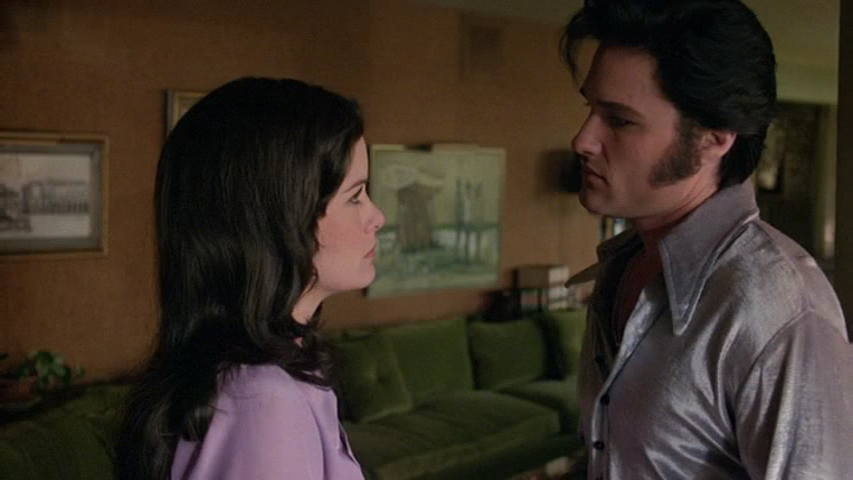
Identify the location of picture. [x=43, y=206], [x=177, y=97], [x=466, y=205].